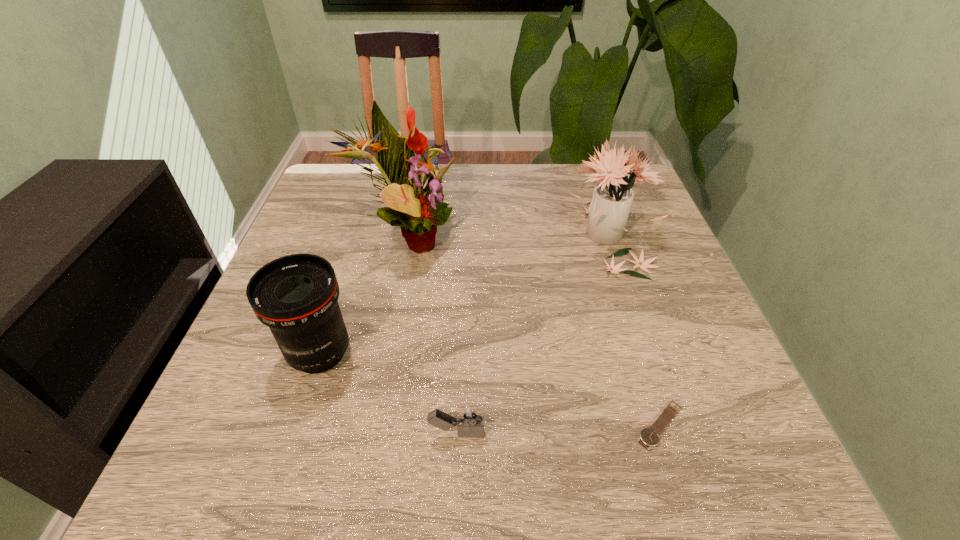
Identify the location of vacant space that satisfies the following two spatial constraints: 1. on the front side of the fourth shortest object; 2. on the front-facing side of the tallest object. Image resolution: width=960 pixels, height=540 pixels. (611, 240).

This screenshot has width=960, height=540. Identify the location of vacant region that satisfies the following two spatial constraints: 1. on the front side of the fourth shortest object; 2. on the front-facing side of the taller bouquet. (611, 240).